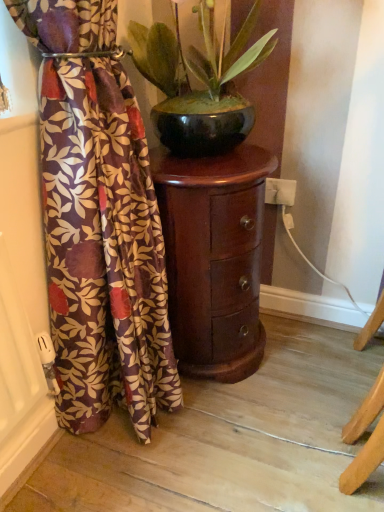
Find the location of a particular element. Image resolution: width=384 pixels, height=512 pixels. free space above mahogany wood side table at center (from a real-world perspective) is located at coordinates (218, 159).